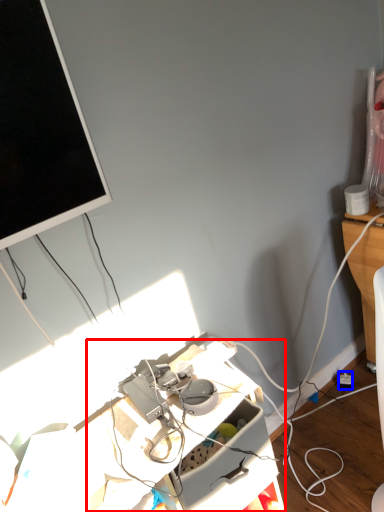
Question: Which object appears closest to the camera in this image, computer desk (highlighted by a red box) or power outlet (highlighted by a blue box)?

Choices:
 (A) computer desk
 (B) power outlet

Answer: (A)